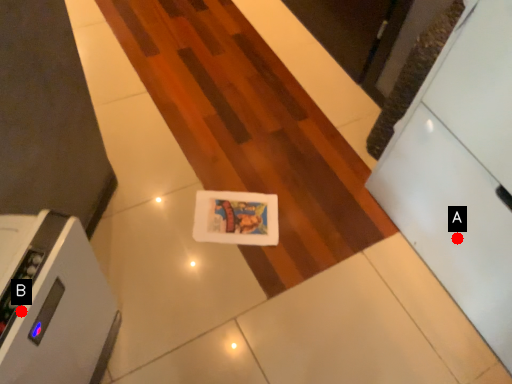
Question: Two points are circled on the image, labeled by A and B beside each circle. Among these points, which one is farthest from the camera?

Choices:
 (A) A is further
 (B) B is further

Answer: (A)